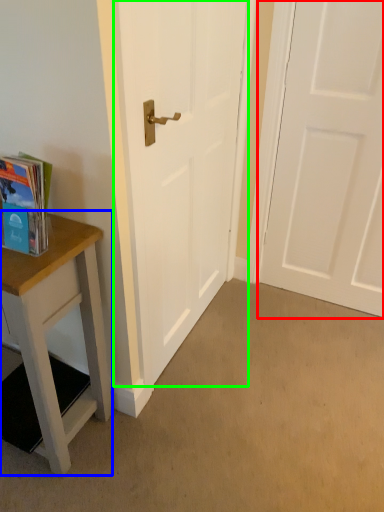
Question: Which object is the closest to the door (highlighted by a red box)? Choose among these: table (highlighted by a blue box) or door (highlighted by a green box).

Choices:
 (A) table
 (B) door

Answer: (B)